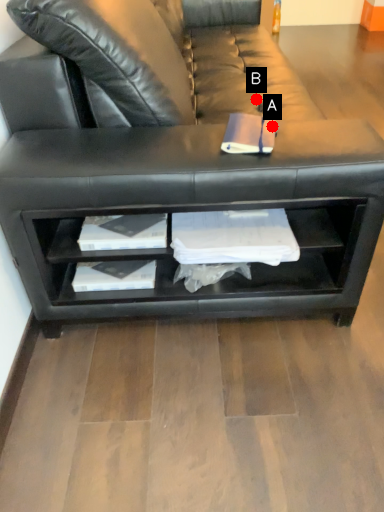
Question: Two points are circled on the image, labeled by A and B beside each circle. Among these points, which one is farthest from the camera?

Choices:
 (A) A is further
 (B) B is further

Answer: (B)